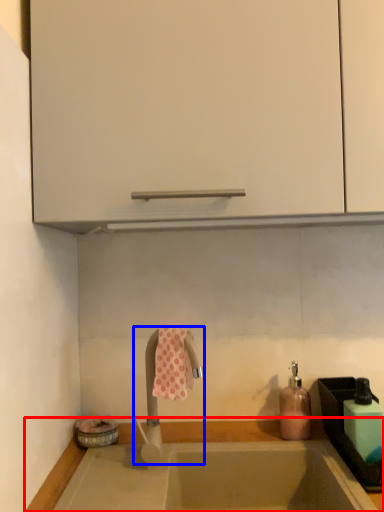
Question: Which object is further to the camera taking this photo, countertop (highlighted by a red box) or tap (highlighted by a blue box)?

Choices:
 (A) countertop
 (B) tap

Answer: (B)